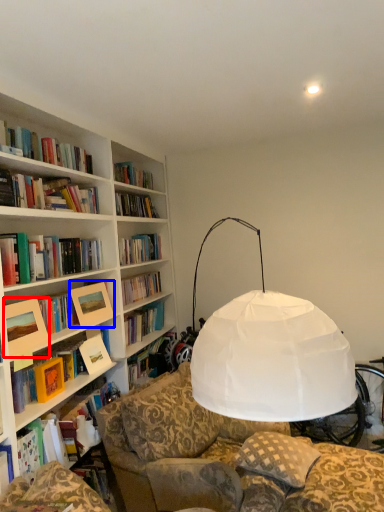
Question: Which object is closer to the camera taking this photo, picture frame (highlighted by a red box) or picture frame (highlighted by a blue box)?

Choices:
 (A) picture frame
 (B) picture frame

Answer: (A)